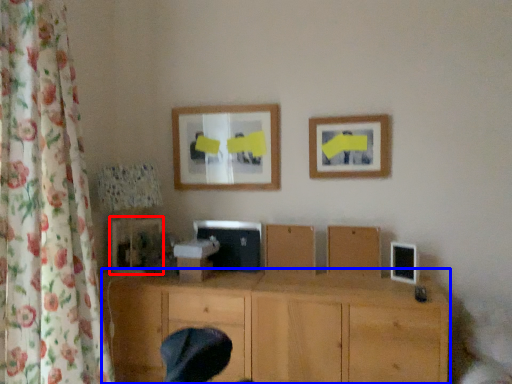
Question: Which of the following is the farthest to the observer, picture frame (highlighted by a red box) or wood (highlighted by a blue box)?

Choices:
 (A) picture frame
 (B) wood

Answer: (A)